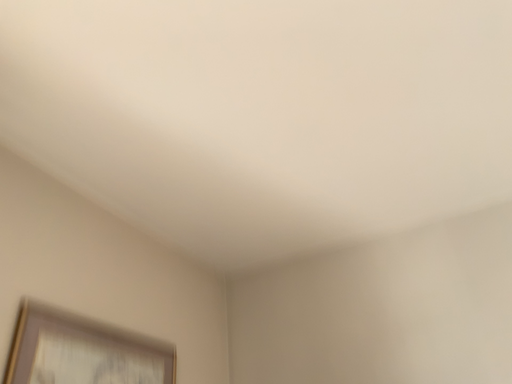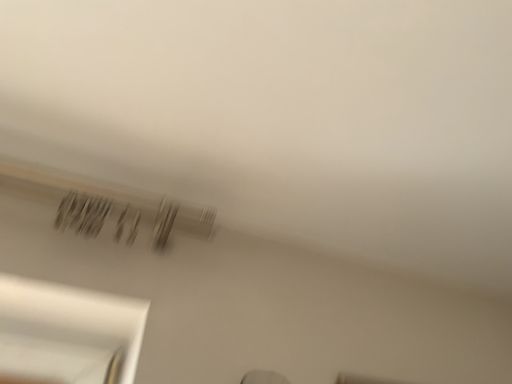
Question: Which way did the camera rotate in the video?

Choices:
 (A) rotated right
 (B) rotated left

Answer: (B)